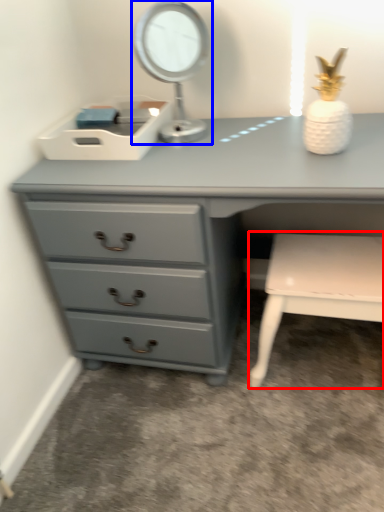
Question: Which object appears farthest to the camera in this image, chair (highlighted by a red box) or table lamp (highlighted by a blue box)?

Choices:
 (A) chair
 (B) table lamp

Answer: (A)